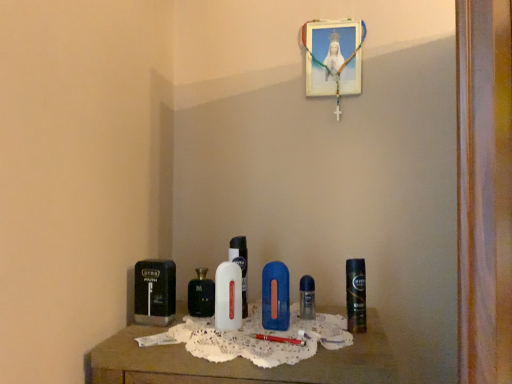
Locate an element on the screen. The image size is (512, 384). free space in front of blue plastic razor at center, arranged as the second personal care when viewed from the right is located at coordinates (279, 344).